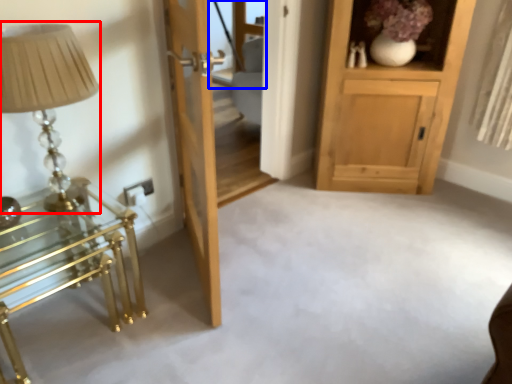
Question: Which object is closer to the camera taking this photo, table lamp (highlighted by a red box) or glass door (highlighted by a blue box)?

Choices:
 (A) table lamp
 (B) glass door

Answer: (A)